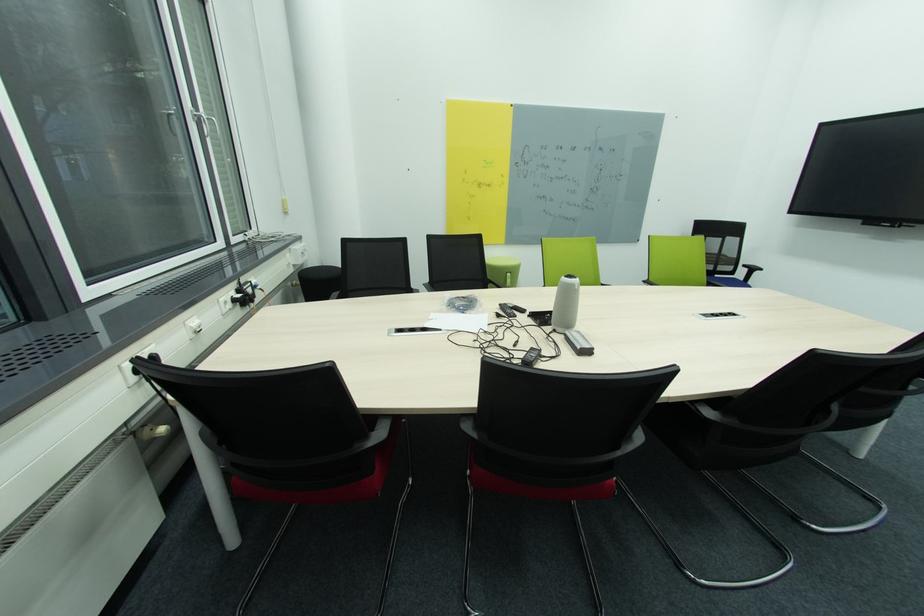
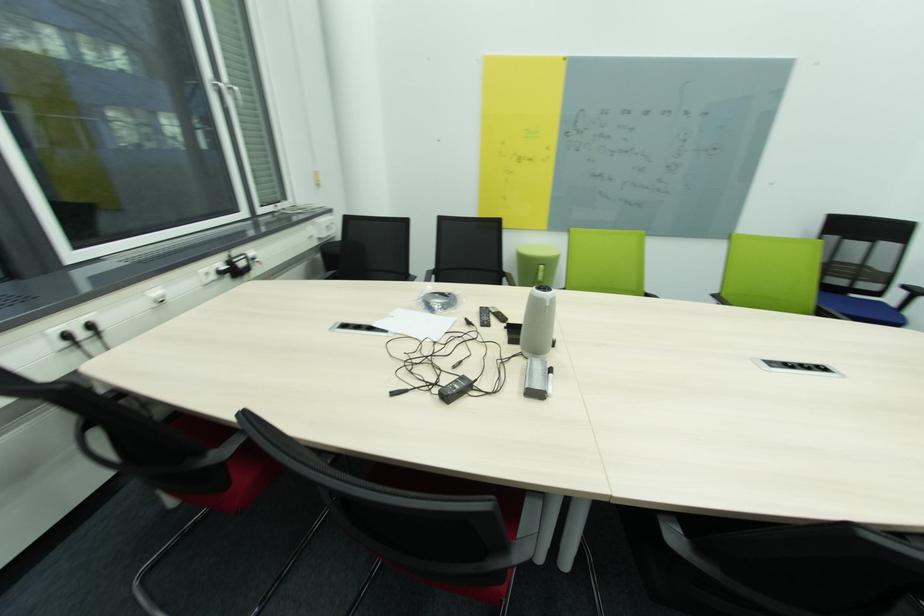
What movement of the cameraman would produce the second image?

The cameraman walked toward right, forward.